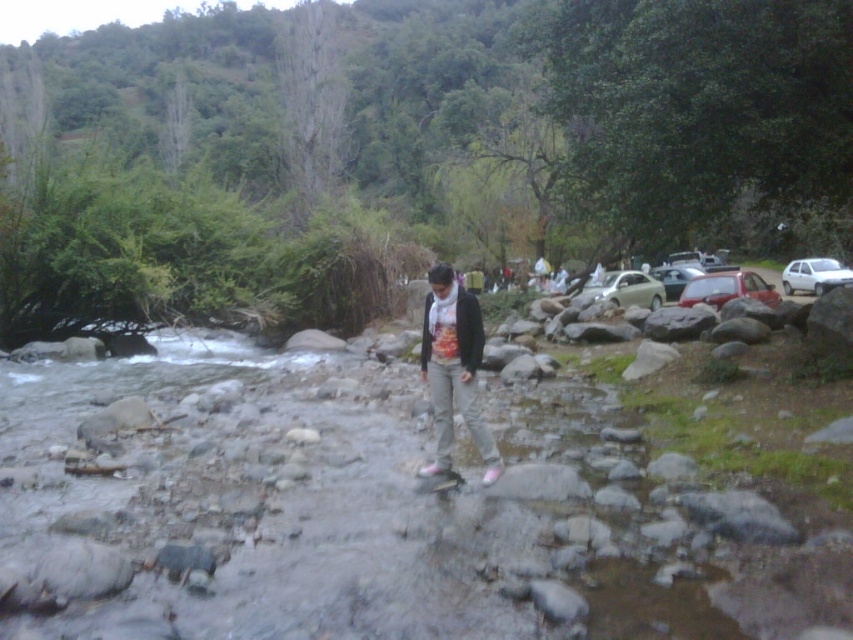
You are a photographer trying to capture the printed cotton shirt at center and the white matte car at right in the same frame. Which object should you focus on first if you want to ensure both are in focus?

The printed cotton shirt at center should be focused on first because it is larger in size compared to the white matte car at right, allowing for better depth of field adjustment.

You are driving a car and want to exit the parking lot. There are two cars in your way on the right side, a satin beige car at right and a metallic silver car at right. Which car must you move first to leave?

The satin beige car at right is positioned under the metallic silver car at right, so you must move the metallic silver car at right first to allow the satin beige car to exit.

You are a photographer positioned at the streambed. You want to capture a photo that includes both the printed cotton shirt at center and the white matte car at right. Which object should you focus on first to ensure both are in sharp focus?

The printed cotton shirt at center is closer to the viewer than the white matte car at right. To ensure both are in sharp focus, you should focus on the printed cotton shirt at center first, as it is the closer object, and adjust the depth of field accordingly.